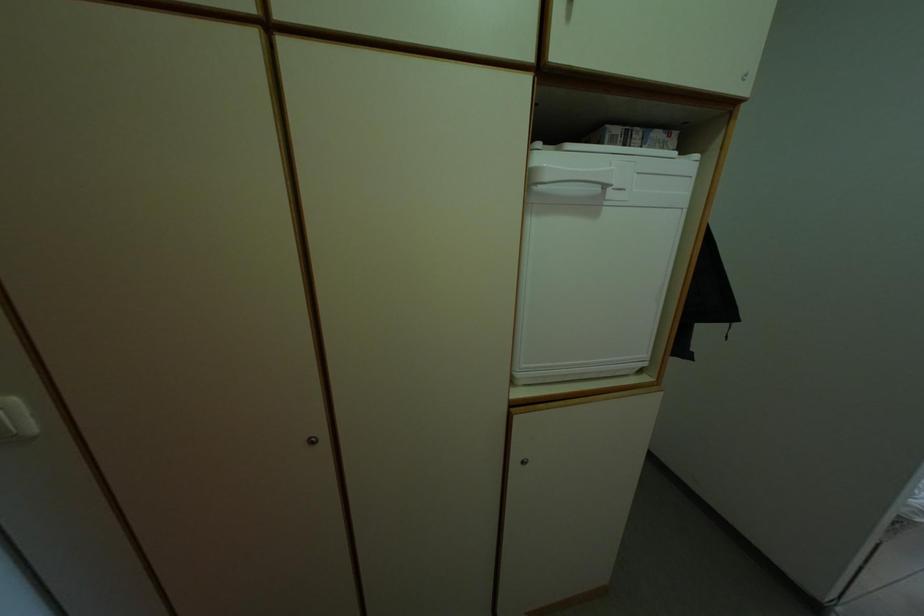
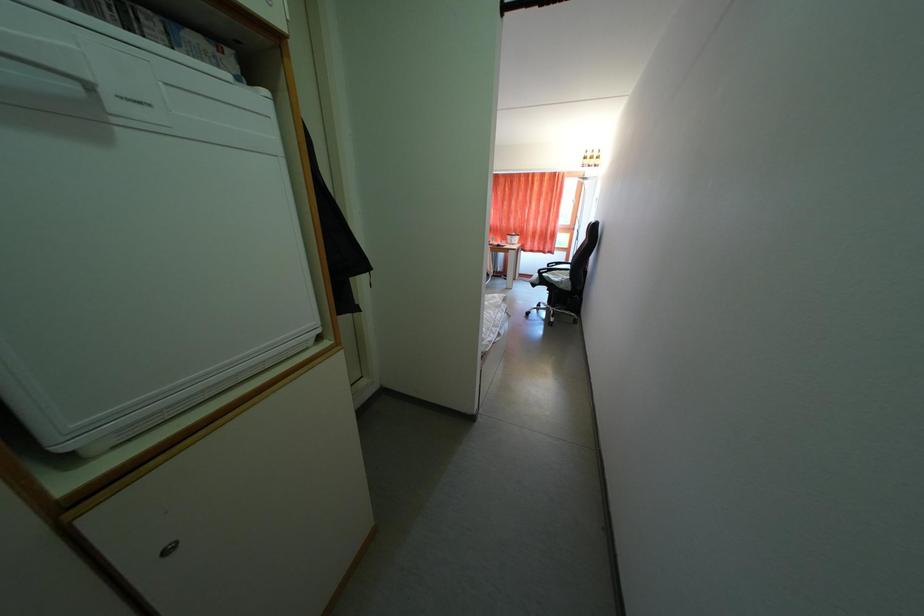
Question: The camera is either moving clockwise (left) or counter-clockwise (right) around the object. The first image is from the beginning of the video and the second image is from the end. Is the camera moving left or right when shooting the video?

Choices:
 (A) Left
 (B) Right

Answer: (A)